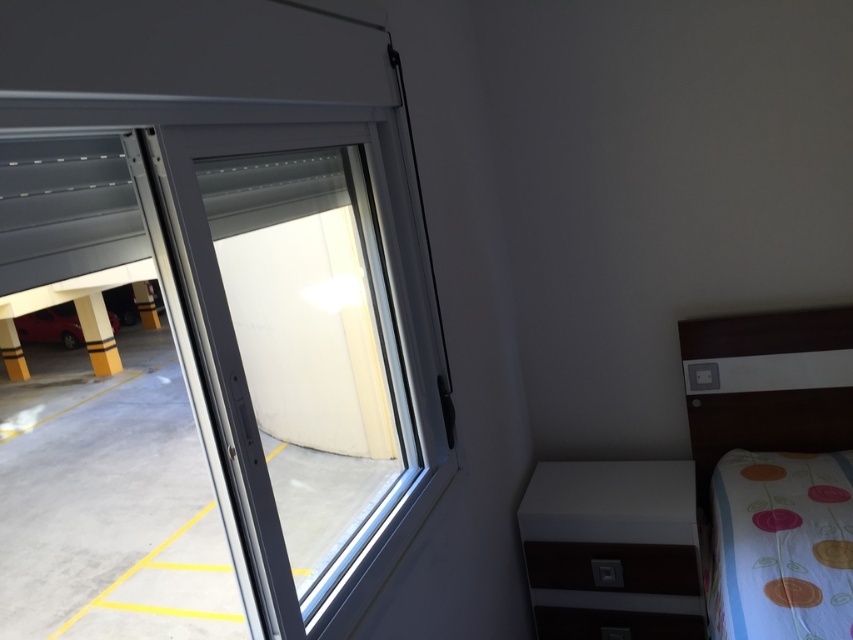
Question: Which object is positioned farthest from the shiny red car at lower left?

Choices:
 (A) white glossy cabinet at lower right
 (B) wooden bed at right
 (C) white plastic window at center

Answer: (B)

Question: Can you confirm if wooden bed at right is positioned above shiny red car at lower left?

Choices:
 (A) no
 (B) yes

Answer: (A)

Question: Can you confirm if wooden bed at right is positioned below shiny red car at lower left?

Choices:
 (A) no
 (B) yes

Answer: (B)

Question: Can you confirm if wooden bed at right is wider than shiny red car at lower left?

Choices:
 (A) yes
 (B) no

Answer: (B)

Question: Which object is closer to the camera taking this photo?

Choices:
 (A) shiny red car at lower left
 (B) wooden bed at right
 (C) white plastic window at center

Answer: (C)

Question: Which of these objects is positioned closest to the white plastic window at center?

Choices:
 (A) white glossy cabinet at lower right
 (B) wooden bed at right

Answer: (A)